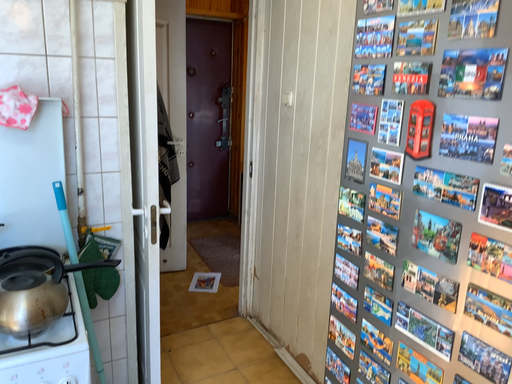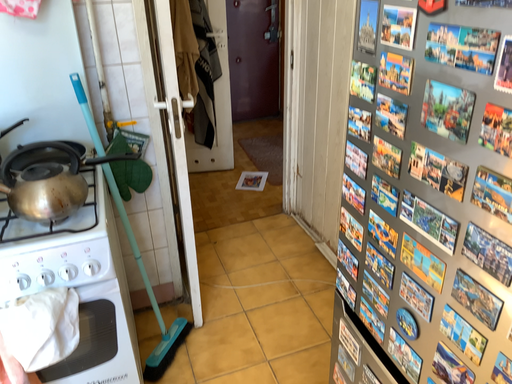
Question: How did the camera likely rotate when shooting the video?

Choices:
 (A) rotated upward
 (B) rotated downward

Answer: (B)